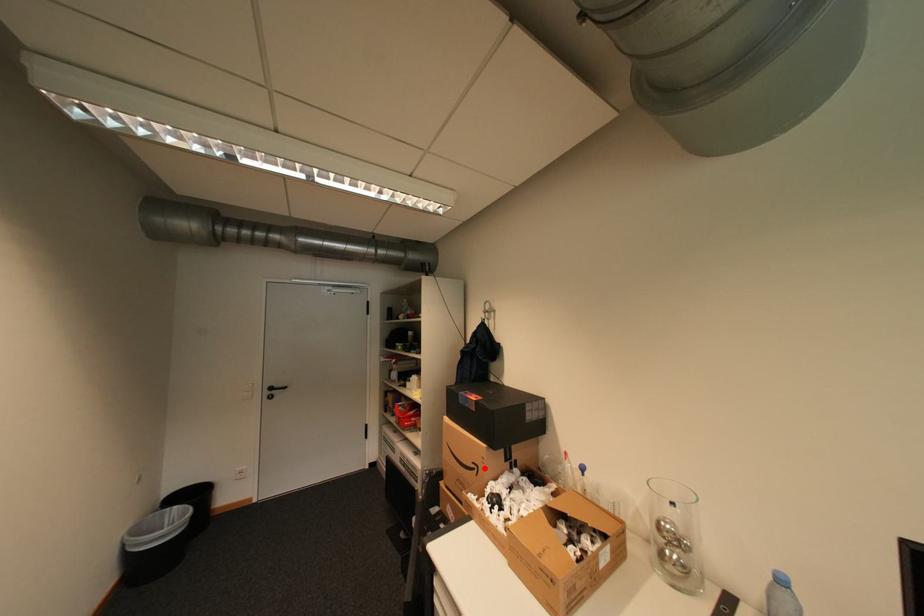
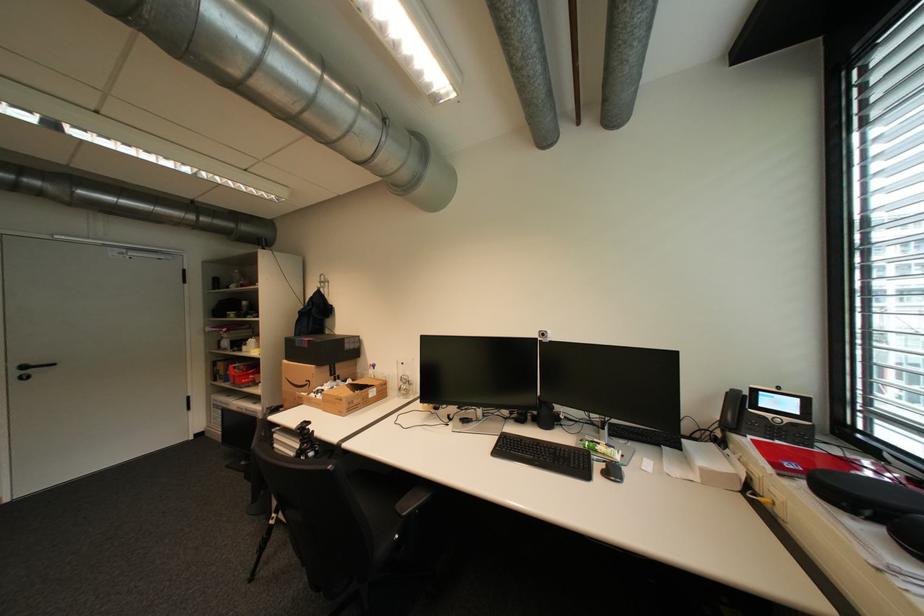
Question: I am providing you with two images of the same scene from different viewpoints. A red point is marked on the first image. At the location where the point appears in image 1, is it still visible in image 2?

Choices:
 (A) Yes
 (B) No

Answer: (A)